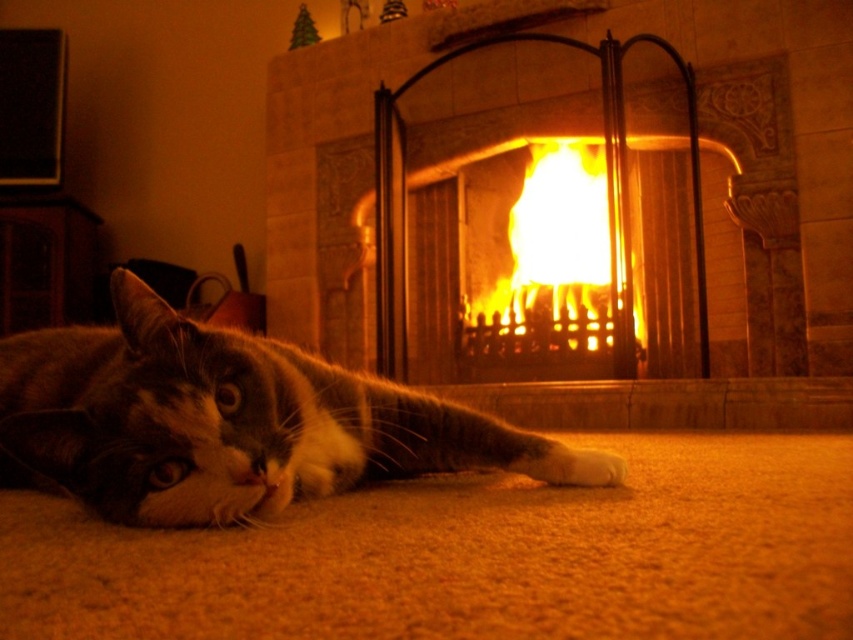
Looking at this image, does matte stone fireplace at center appear on the left side of flamematerial/texture at center?

Correct, you'll find matte stone fireplace at center to the left of flamematerial/texture at center.

Can you confirm if matte stone fireplace at center is thinner than flamematerial/texture at center?

No, matte stone fireplace at center is not thinner than flamematerial/texture at center.

Who is more distant from viewer, (666,416) or (605,275)?

Point (605,275)

I want to click on matte stone fireplace at center, so click(792, 102).

Does point (386, 461) come in front of point (349, 36)?

Yes, it is.

Which of these two, tabby fur cat at lower left or matte stone fireplace at center, stands shorter?

Standing shorter between the two is tabby fur cat at lower left.

Between point (67, 340) and point (838, 109), which one is positioned in front?

Positioned in front is point (67, 340).

This screenshot has width=853, height=640. I want to click on tabby fur cat at lower left, so click(229, 420).

Which of these two, tabby fur cat at lower left or flamematerial/texture at center, stands taller?

Standing taller between the two is flamematerial/texture at center.

Consider the image. Between tabby fur cat at lower left and flamematerial/texture at center, which one is positioned lower?

Positioned lower is tabby fur cat at lower left.

In order to click on tabby fur cat at lower left in this screenshot , I will do `click(229, 420)`.